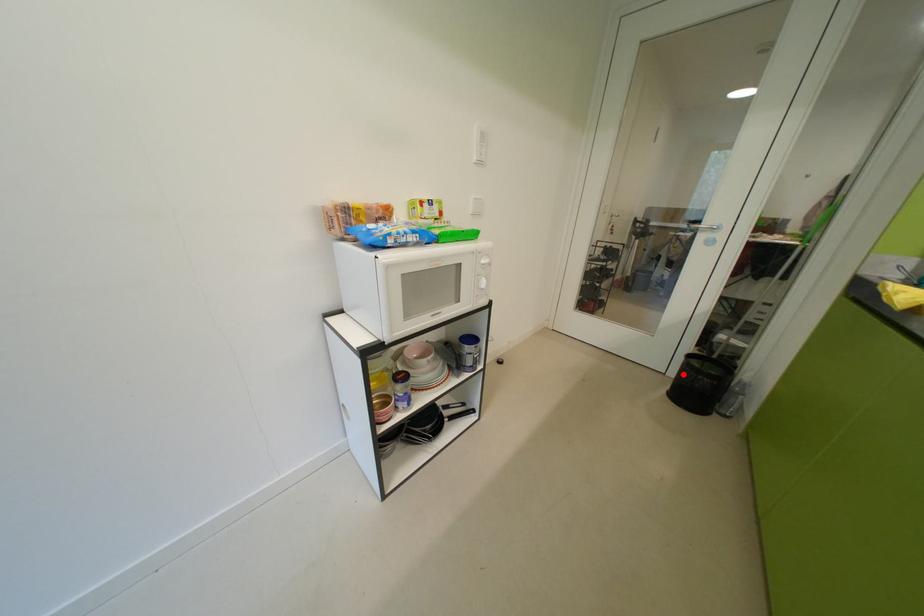
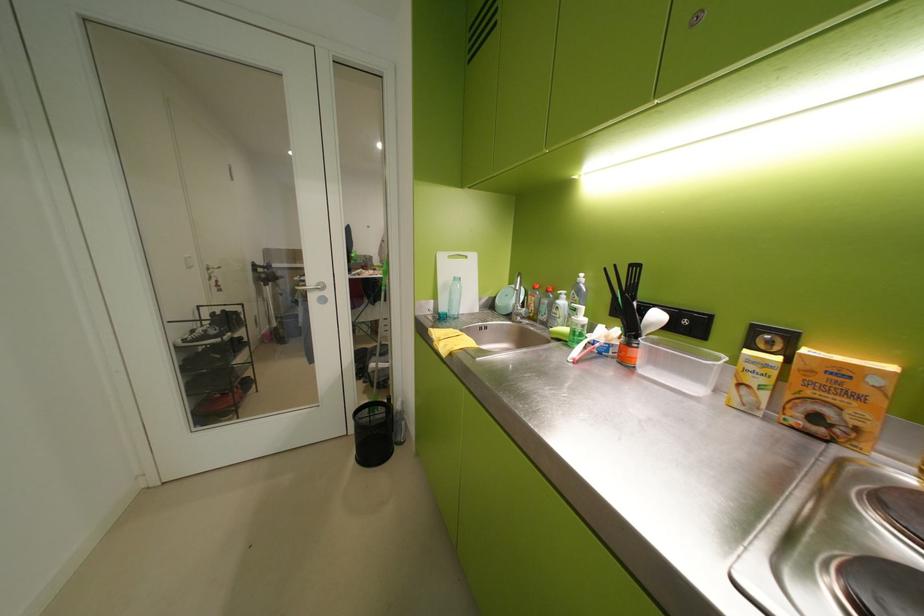
Question: A red point is marked in image1. In image2, is the corresponding 3D point closer to the camera or farther? Reply with the corresponding letter.

Choices:
 (A) The corresponding 3D point is closer.
 (B) The corresponding 3D point is farther.

Answer: (B)